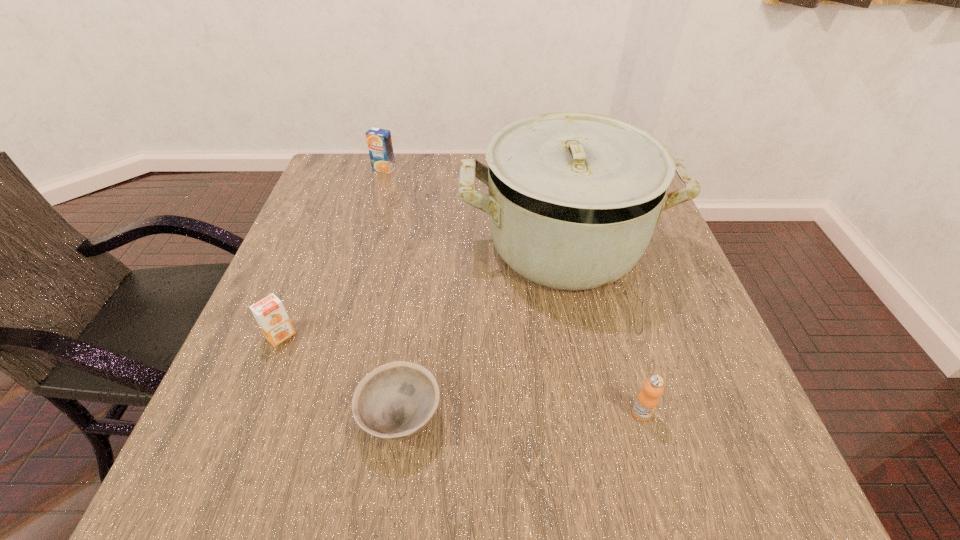
This screenshot has height=540, width=960. I want to click on vacant space that's between the second farthest object and the shortest object, so click(482, 331).

Where is `vacant space in between the second orange juice from right to left and the rightmost orange juice`? vacant space in between the second orange juice from right to left and the rightmost orange juice is located at coordinates (513, 291).

In order to click on unoccupied position between the nearest orange juice and the shortest object in this screenshot , I will do `click(521, 415)`.

Where is `vacant space that's between the farthest orange juice and the third farthest object`? This screenshot has width=960, height=540. vacant space that's between the farthest orange juice and the third farthest object is located at coordinates (332, 252).

Where is `free space between the nearest orange juice and the saucepan`? free space between the nearest orange juice and the saucepan is located at coordinates coord(603,329).

Image resolution: width=960 pixels, height=540 pixels. What are the coordinates of `unoccupied area between the leftmost object and the tallest object` in the screenshot? It's located at (422, 290).

Locate which object is the third closest to the third nearest object. Please provide its 2D coordinates. Your answer should be formatted as a tuple, i.e. [(x, y)], where the tuple contains the x and y coordinates of a point satisfying the conditions above.

[(379, 141)]

Locate an element on the screen. the closest object to the third object from right to left is located at coordinates [x=269, y=312].

Locate an element on the screen. orange juice that is the second closest to the saucepan is located at coordinates (379, 141).

Identify which orange juice is the nearest to the nearest orange juice. Please provide its 2D coordinates. Your answer should be formatted as a tuple, i.e. [(x, y)], where the tuple contains the x and y coordinates of a point satisfying the conditions above.

[(269, 312)]